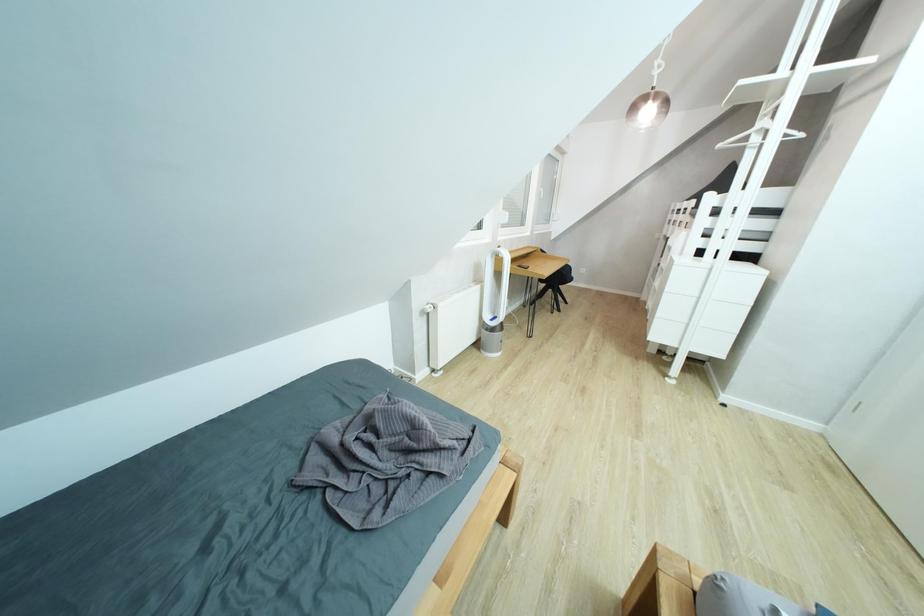
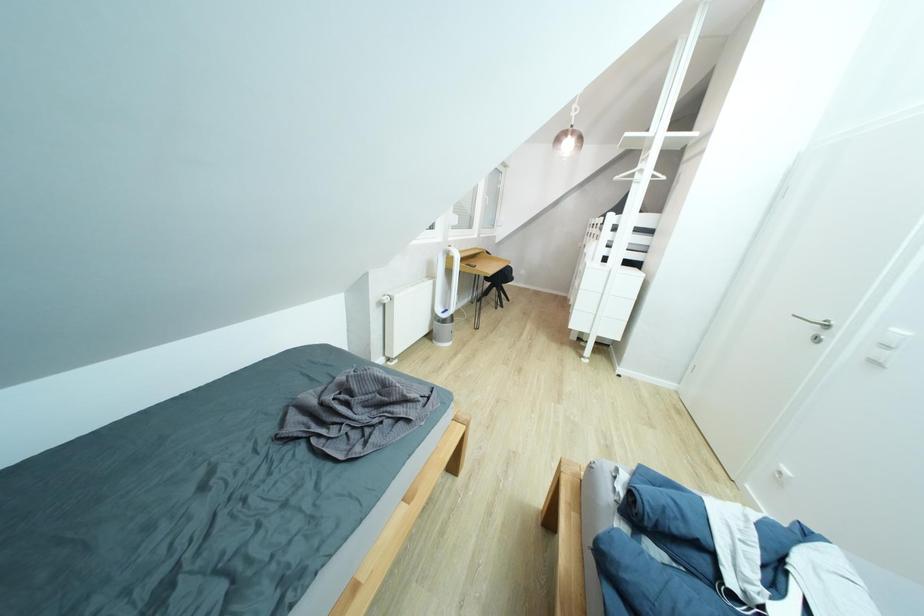
Question: The camera is either moving clockwise (left) or counter-clockwise (right) around the object. The first image is from the beginning of the video and the second image is from the end. Is the camera moving left or right when shooting the video?

Choices:
 (A) Left
 (B) Right

Answer: (A)